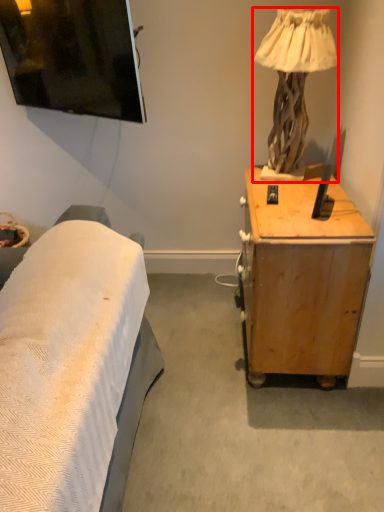
Question: Observing the image, what is the correct spatial positioning of lamp (annotated by the red box) in reference to desk?

Choices:
 (A) right
 (B) left

Answer: (B)